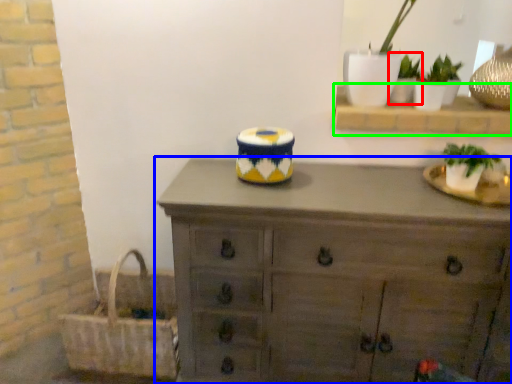
Question: Estimate the real-world distances between objects in this image. Which object is closer to houseplant (highlighted by a red box), chest of drawers (highlighted by a blue box) or shelf (highlighted by a green box)?

Choices:
 (A) chest of drawers
 (B) shelf

Answer: (B)